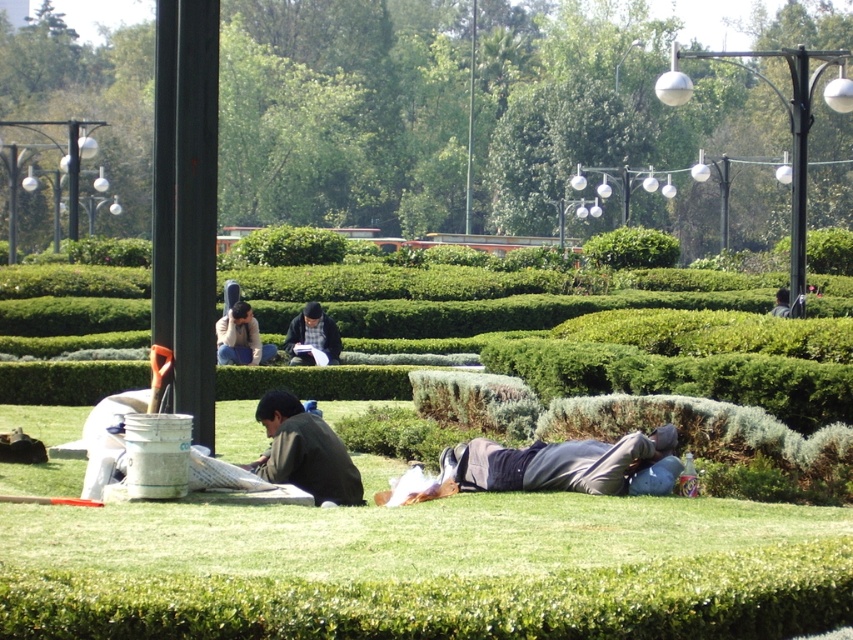
Question: Which object appears farthest from the camera in this image?

Choices:
 (A) dark gray shirt at center
 (B) matte black jacket at center

Answer: (B)

Question: Is matte black jacket at center bigger than dark gray shirt at center?

Choices:
 (A) no
 (B) yes

Answer: (A)

Question: Is dark gray sweater at lower center positioned behind dark gray sweater at center?

Choices:
 (A) yes
 (B) no

Answer: (B)

Question: Which point is closer to the camera?

Choices:
 (A) dark gray sweater at center
 (B) dark gray shirt at center

Answer: (B)

Question: Does green leafy bush at center have a smaller size compared to matte black jacket at center?

Choices:
 (A) no
 (B) yes

Answer: (A)

Question: Estimate the real-world distances between objects in this image. Which object is closer to the green leafy bush at center?

Choices:
 (A) dark gray shirt at center
 (B) matte black jacket at center
 (C) dark gray sweater at center
 (D) dark gray sweater at lower center

Answer: (A)